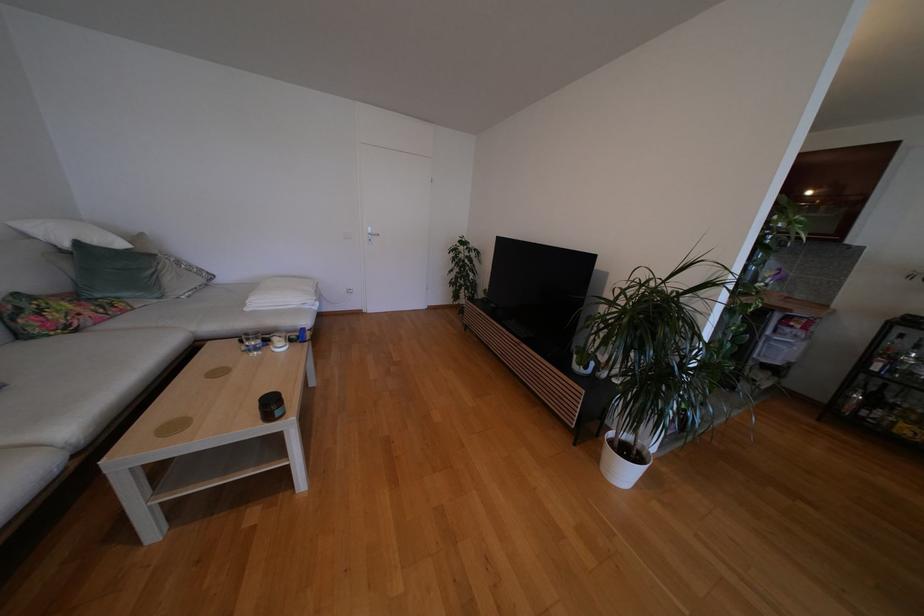
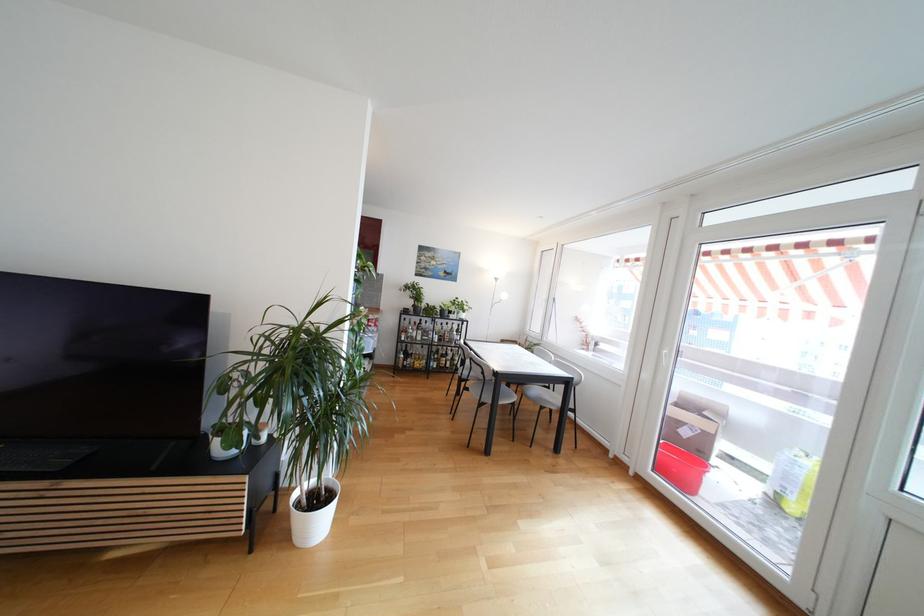
Find the pixel in the second image that matches (x=621, y=453) in the first image.

(310, 511)